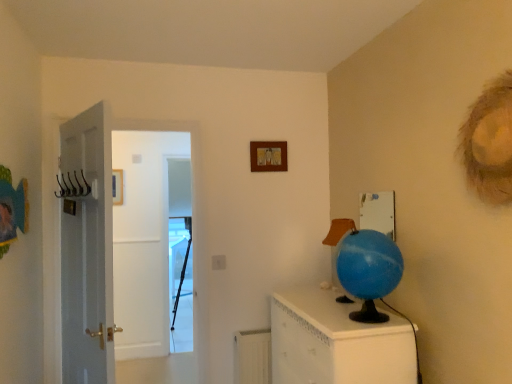
Question: From the image's perspective, is transparent plastic screen door at center positioned above or below blue rubber globe at right?

Choices:
 (A) below
 (B) above

Answer: (A)

Question: Is transparent plastic screen door at center spatially inside blue rubber globe at right, or outside of it?

Choices:
 (A) inside
 (B) outside

Answer: (B)

Question: Which of these objects is positioned closest to the blue rubber globe at right?

Choices:
 (A) wooden picture frame at upper center
 (B) metallic wire hanger at left
 (C) blue glossy globe at right
 (D) transparent plastic screen door at center
 (E) white plastic radiator at lower center

Answer: (A)

Question: Which is nearer to the metallic wire hanger at left?

Choices:
 (A) blue glossy globe at right
 (B) blue rubber globe at right
 (C) wooden picture frame at upper center
 (D) transparent plastic screen door at center
 (E) white plastic radiator at lower center

Answer: (C)